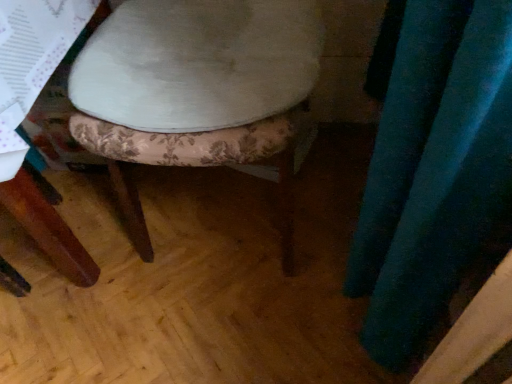
Question: Would you say velvet teal curtain at right is outside velvet floral-patterned stool at center?

Choices:
 (A) yes
 (B) no

Answer: (A)

Question: Is velvet teal curtain at right at the left side of velvet floral-patterned stool at center?

Choices:
 (A) yes
 (B) no

Answer: (B)

Question: From the image's perspective, is velvet teal curtain at right located beneath velvet floral-patterned stool at center?

Choices:
 (A) no
 (B) yes

Answer: (B)

Question: Is velvet teal curtain at right closer to camera compared to velvet floral-patterned stool at center?

Choices:
 (A) yes
 (B) no

Answer: (A)

Question: Is velvet teal curtain at right oriented away from velvet floral-patterned stool at center?

Choices:
 (A) yes
 (B) no

Answer: (B)

Question: Does velvet teal curtain at right have a greater height compared to velvet floral-patterned stool at center?

Choices:
 (A) yes
 (B) no

Answer: (B)

Question: From a real-world perspective, is velvet floral-patterned stool at center on velvet teal curtain at right?

Choices:
 (A) yes
 (B) no

Answer: (B)

Question: Considering the relative sizes of velvet floral-patterned stool at center and velvet teal curtain at right in the image provided, is velvet floral-patterned stool at center wider than velvet teal curtain at right?

Choices:
 (A) yes
 (B) no

Answer: (A)

Question: Is velvet floral-patterned stool at center not within velvet teal curtain at right?

Choices:
 (A) yes
 (B) no

Answer: (A)

Question: Can you confirm if velvet floral-patterned stool at center is thinner than velvet teal curtain at right?

Choices:
 (A) no
 (B) yes

Answer: (A)

Question: Is there a large distance between velvet floral-patterned stool at center and velvet teal curtain at right?

Choices:
 (A) no
 (B) yes

Answer: (A)

Question: From the image's perspective, is velvet floral-patterned stool at center over velvet teal curtain at right?

Choices:
 (A) yes
 (B) no

Answer: (A)

Question: From their relative heights in the image, would you say velvet floral-patterned stool at center is taller or shorter than velvet teal curtain at right?

Choices:
 (A) short
 (B) tall

Answer: (B)